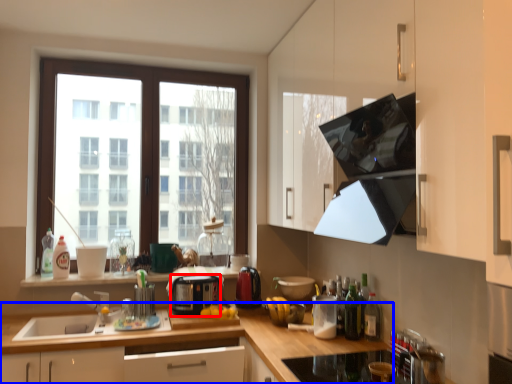
Question: Which object is further to the camera taking this photo, appliance (highlighted by a red box) or cabinetry (highlighted by a blue box)?

Choices:
 (A) appliance
 (B) cabinetry

Answer: (A)